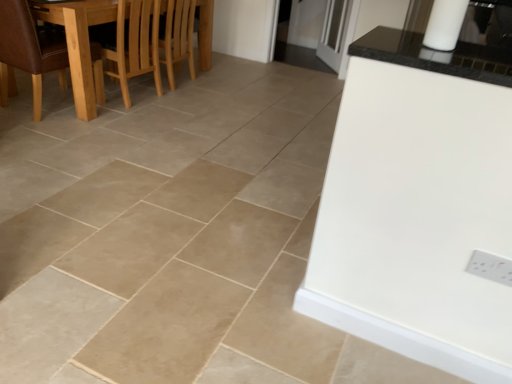
Locate an element on the screen. free space to the right of light brown wooden chair at upper left is located at coordinates (211, 89).